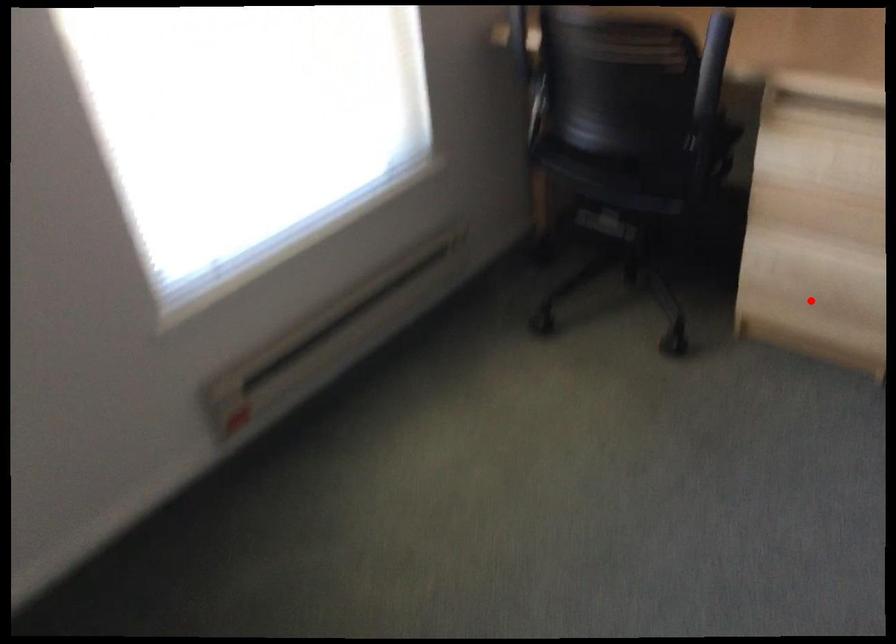
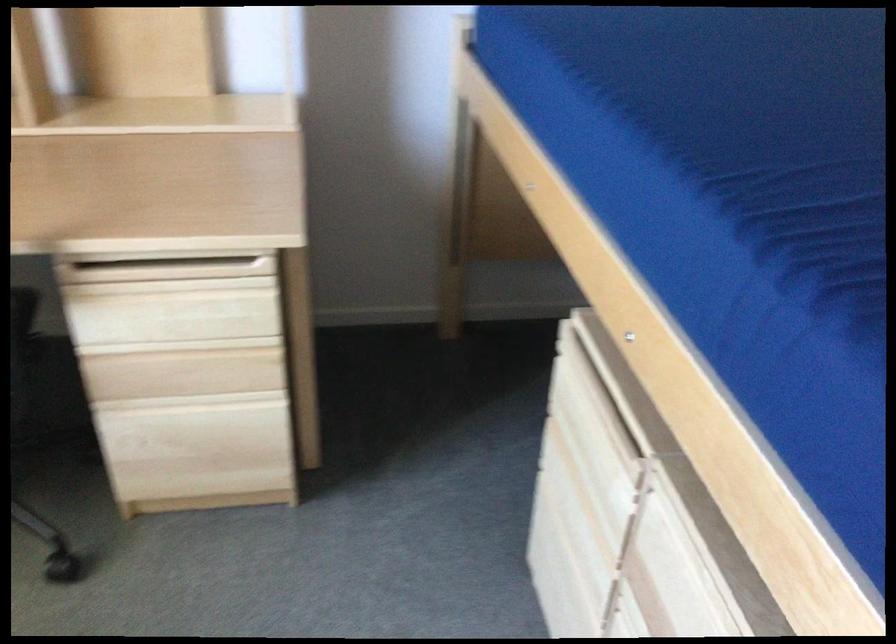
Locate, in the second image, the point that corresponds to the highlighted location in the first image.

(202, 460)